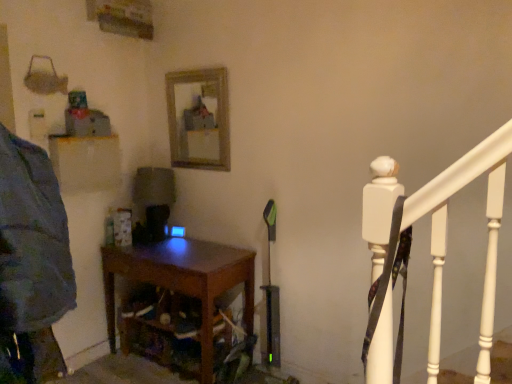
Question: In terms of width, does dark wood table at center look wider or thinner when compared to wooden frame mirror at upper center?

Choices:
 (A) thin
 (B) wide

Answer: (B)

Question: From a real-world perspective, is dark wood table at center positioned above or below wooden frame mirror at upper center?

Choices:
 (A) below
 (B) above

Answer: (A)

Question: Is dark wood table at center bigger or smaller than wooden frame mirror at upper center?

Choices:
 (A) big
 (B) small

Answer: (A)

Question: Considering the positions of wooden frame mirror at upper center and dark wood table at center in the image, is wooden frame mirror at upper center wider or thinner than dark wood table at center?

Choices:
 (A) wide
 (B) thin

Answer: (B)

Question: From the image's perspective, is wooden frame mirror at upper center positioned above or below dark wood table at center?

Choices:
 (A) above
 (B) below

Answer: (A)

Question: Is wooden frame mirror at upper center in front of or behind dark wood table at center in the image?

Choices:
 (A) front
 (B) behind

Answer: (B)

Question: In terms of size, does wooden frame mirror at upper center appear bigger or smaller than dark wood table at center?

Choices:
 (A) big
 (B) small

Answer: (B)